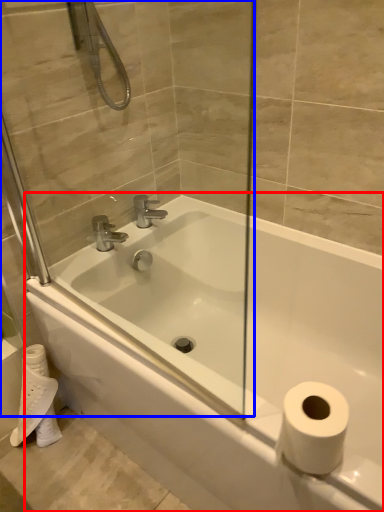
Question: Which object appears farthest to the camera in this image, bathtub (highlighted by a red box) or glass door (highlighted by a blue box)?

Choices:
 (A) bathtub
 (B) glass door

Answer: (A)